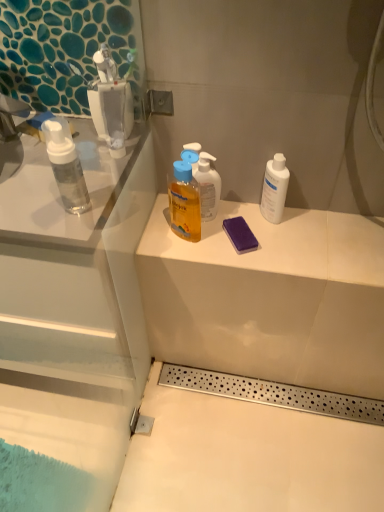
Where is `free space to the left of purple sponge at center`? This screenshot has width=384, height=512. free space to the left of purple sponge at center is located at coordinates (186, 238).